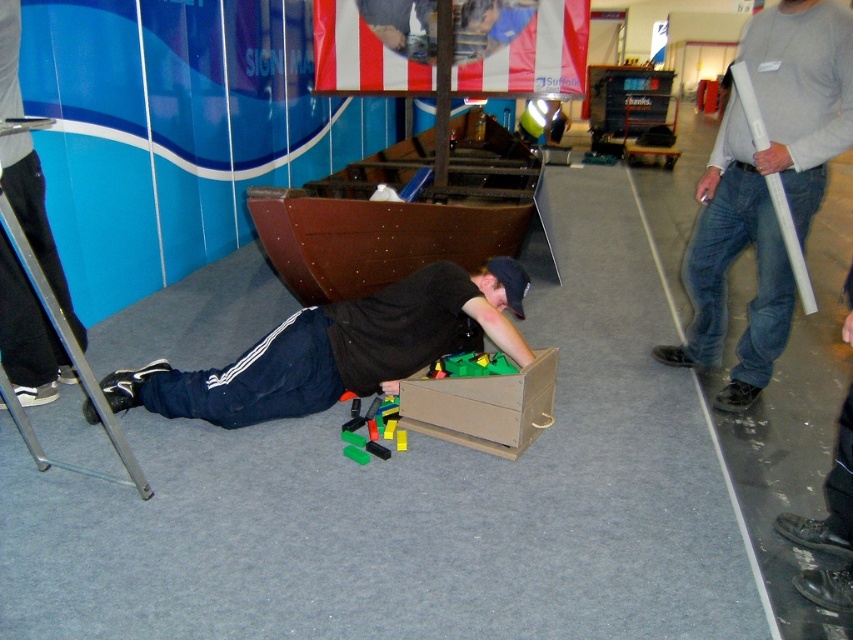
Between brown cardboard box at center and green plastic blocks at center, which one has less height?

green plastic blocks at center is shorter.

What do you see at coordinates (483, 406) in the screenshot?
I see `brown cardboard box at center` at bounding box center [483, 406].

Find the location of `brown cardboard box at center`. brown cardboard box at center is located at coordinates (483, 406).

Can you confirm if gray fabric shirt at upper right is smaller than black matte shirt at center?

Actually, gray fabric shirt at upper right might be larger than black matte shirt at center.

From the picture: Measure the distance between point (726, 266) and camera.

A distance of 3.05 meters exists between point (726, 266) and camera.

Identify the location of gray fabric shirt at upper right. (764, 186).

Can you confirm if gray fabric shirt at upper right is taller than brown cardboard box at center?

Yes.

Can you confirm if gray fabric shirt at upper right is positioned below brown cardboard box at center?

No, gray fabric shirt at upper right is not below brown cardboard box at center.

This screenshot has height=640, width=853. I want to click on gray fabric shirt at upper right, so click(x=764, y=186).

Where is `gray fabric shirt at upper right`? The image size is (853, 640). gray fabric shirt at upper right is located at coordinates (764, 186).